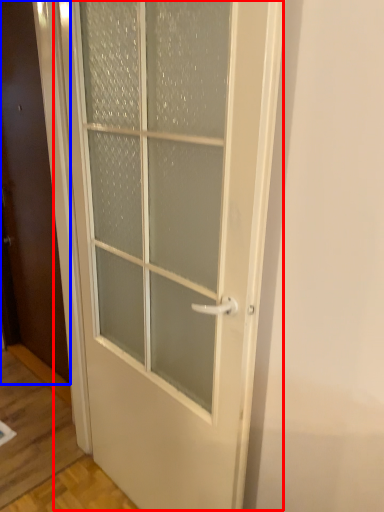
Question: Among these objects, which one is nearest to the camera, door (highlighted by a red box) or door (highlighted by a blue box)?

Choices:
 (A) door
 (B) door

Answer: (A)